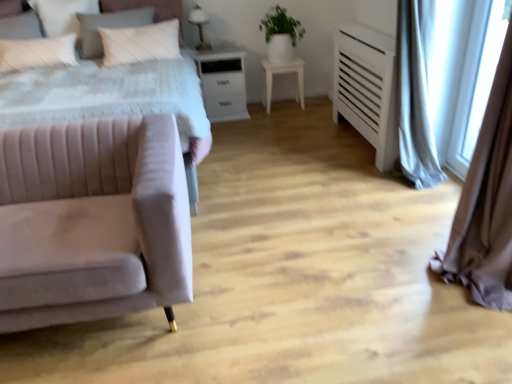
Identify the location of free region on the left part of light gray fabric curtain at right. This screenshot has width=512, height=384. (368, 208).